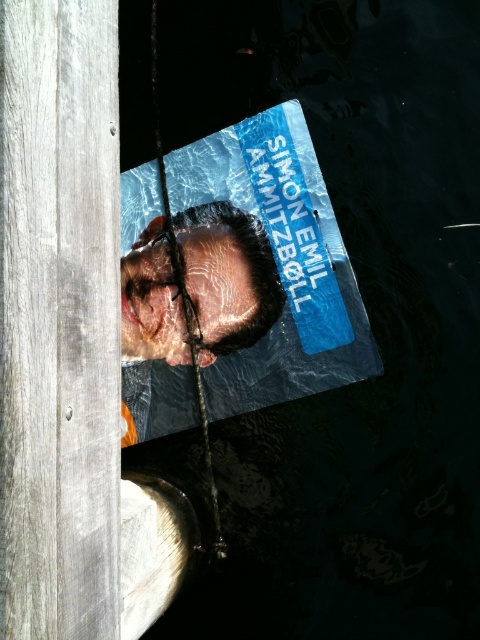
You are designing a display for an art exhibition. You have two items to place side by side on a shelf. The items are the matte plastic poster at center and the shiny metallic head at center. Based on their sizes, which item should you place on the left to ensure they fit within the shelf space?

The matte plastic poster at center might be wider than the shiny metallic head at center, so placing the wider matte plastic poster at center on the left would allow both items to fit better on the shelf.

You are a photographer trying to capture the shiny metallic head at center in focus while also including the matte plastic poster at center in your shot. Which object should you adjust your camera focus on first to ensure both are in focus?

You should focus on the shiny metallic head at center first because it is farther away from the viewer compared to the matte plastic poster at center. By focusing on the farther object, you can increase the depth of field to include both in focus.